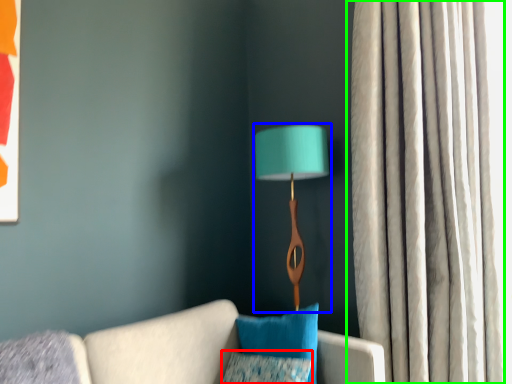
Question: Which object is the closest to the pillow (highlighted by a red box)? Choose among these: lamp (highlighted by a blue box) or curtain (highlighted by a green box).

Choices:
 (A) lamp
 (B) curtain

Answer: (A)